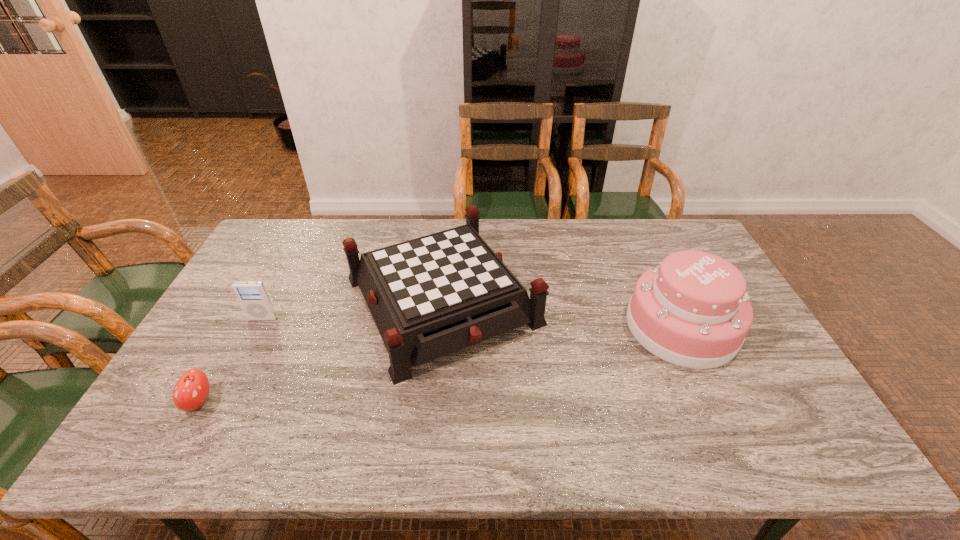
Find the location of `free space that satisfies the following two spatial constraints: 1. on the front side of the tallest object; 2. on the left side of the checkerboard`. free space that satisfies the following two spatial constraints: 1. on the front side of the tallest object; 2. on the left side of the checkerboard is located at coordinates (440, 326).

The image size is (960, 540). What are the coordinates of `vacant area in the image that satisfies the following two spatial constraints: 1. on the front-facing side of the tallest object; 2. on the left side of the second shortest object` in the screenshot? It's located at (259, 326).

Image resolution: width=960 pixels, height=540 pixels. I want to click on vacant space that satisfies the following two spatial constraints: 1. on the front-facing side of the rightmost object; 2. on the right side of the third tallest object, so pos(259,326).

The height and width of the screenshot is (540, 960). I want to click on free space that satisfies the following two spatial constraints: 1. on the front side of the third object from left to right; 2. on the left side of the cake, so click(x=440, y=326).

Locate an element on the screen. vacant space that satisfies the following two spatial constraints: 1. on the front side of the checkerboard; 2. on the right side of the cake is located at coordinates (440, 326).